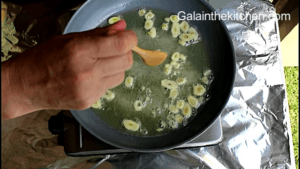
The image size is (300, 169). I want to click on portable stove top, so click(208, 143).